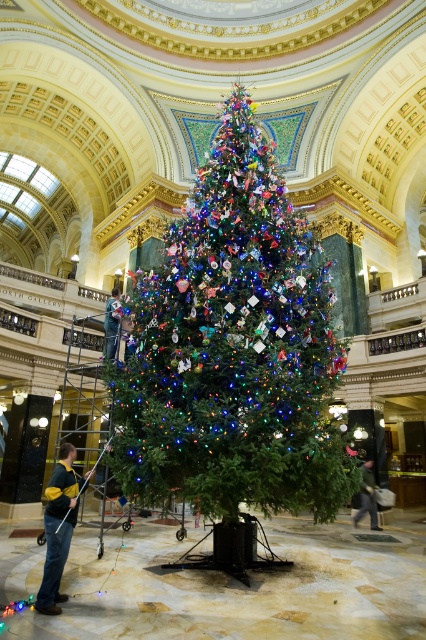
You are organizing a winter clothing drive and need to determine which jackets to prioritize based on size. Given the green fleece jacket at lower left and the denim jacket at lower right, which one should you choose if you need a larger jacket?

The green fleece jacket at lower left has a larger size compared to the denim jacket at lower right, so you should choose the green fleece jacket at lower left.

You are standing in front of the Christmas tree and need to choose a jacket to place on the marble floor. Which jacket has a greater width between the green fleece jacket at lower left and the denim jacket at lower right?

The green fleece jacket at lower left has a greater width than the denim jacket at lower right according to the description.